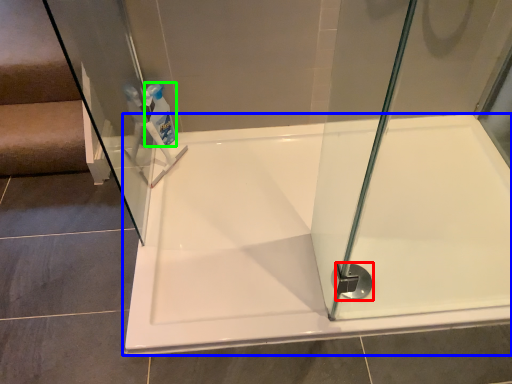
Question: Considering the real-world distances, which object is closest to shower (highlighted by a red box)? bathtub (highlighted by a blue box) or cleaning product (highlighted by a green box).

Choices:
 (A) bathtub
 (B) cleaning product

Answer: (A)